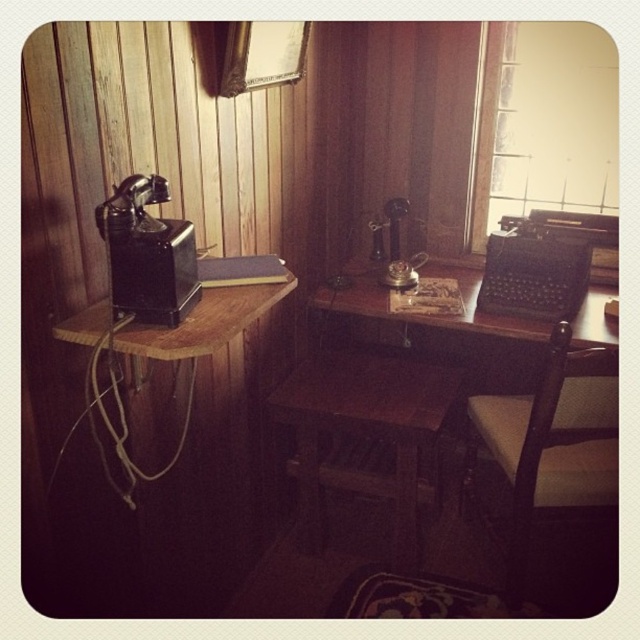
How far apart are wooden stool at center and light brown wooden chair at lower right?

wooden stool at center and light brown wooden chair at lower right are 15.29 inches apart.

Is point (432, 401) positioned before point (528, 496)?

No, it is behind (528, 496).

Is point (292, 406) positioned behind point (513, 438)?

Yes.

Locate an element on the screen. Image resolution: width=640 pixels, height=640 pixels. wooden stool at center is located at coordinates (365, 433).